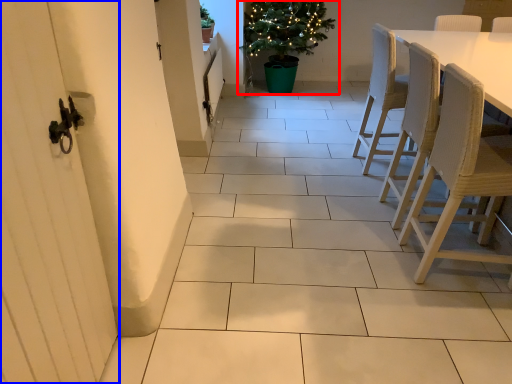
Question: Which object is closer to the camera taking this photo, houseplant (highlighted by a red box) or screen door (highlighted by a blue box)?

Choices:
 (A) houseplant
 (B) screen door

Answer: (B)